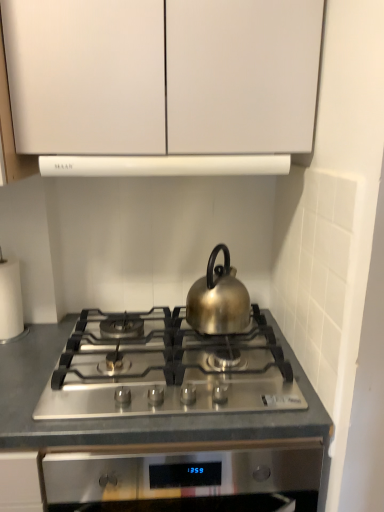
Question: Can you confirm if stainless steel cooktop at center is wider than satin silver gas stove at center?

Choices:
 (A) no
 (B) yes

Answer: (B)

Question: From a real-world perspective, is stainless steel cooktop at center below satin silver gas stove at center?

Choices:
 (A) yes
 (B) no

Answer: (A)

Question: Is satin silver gas stove at center at the back of stainless steel cooktop at center?

Choices:
 (A) no
 (B) yes

Answer: (A)

Question: Is stainless steel cooktop at center smaller than satin silver gas stove at center?

Choices:
 (A) yes
 (B) no

Answer: (B)

Question: Can you confirm if stainless steel cooktop at center is positioned to the right of satin silver gas stove at center?

Choices:
 (A) yes
 (B) no

Answer: (A)

Question: From the image's perspective, is stainless steel cooktop at center over satin silver gas stove at center?

Choices:
 (A) no
 (B) yes

Answer: (A)

Question: Is white paper at left behind stainless steel cooktop at center?

Choices:
 (A) yes
 (B) no

Answer: (A)

Question: Is white paper at left located outside stainless steel cooktop at center?

Choices:
 (A) no
 (B) yes

Answer: (B)

Question: Is white paper at left positioned before stainless steel cooktop at center?

Choices:
 (A) yes
 (B) no

Answer: (B)

Question: Is white paper at left smaller than stainless steel cooktop at center?

Choices:
 (A) yes
 (B) no

Answer: (A)

Question: Considering the relative positions of white paper at left and stainless steel cooktop at center in the image provided, is white paper at left to the right of stainless steel cooktop at center from the viewer's perspective?

Choices:
 (A) yes
 (B) no

Answer: (B)

Question: From the image's perspective, is white paper at left located beneath stainless steel cooktop at center?

Choices:
 (A) yes
 (B) no

Answer: (B)

Question: From the image's perspective, would you say shiny metallic kettle at center is shown under white paper at left?

Choices:
 (A) yes
 (B) no

Answer: (B)